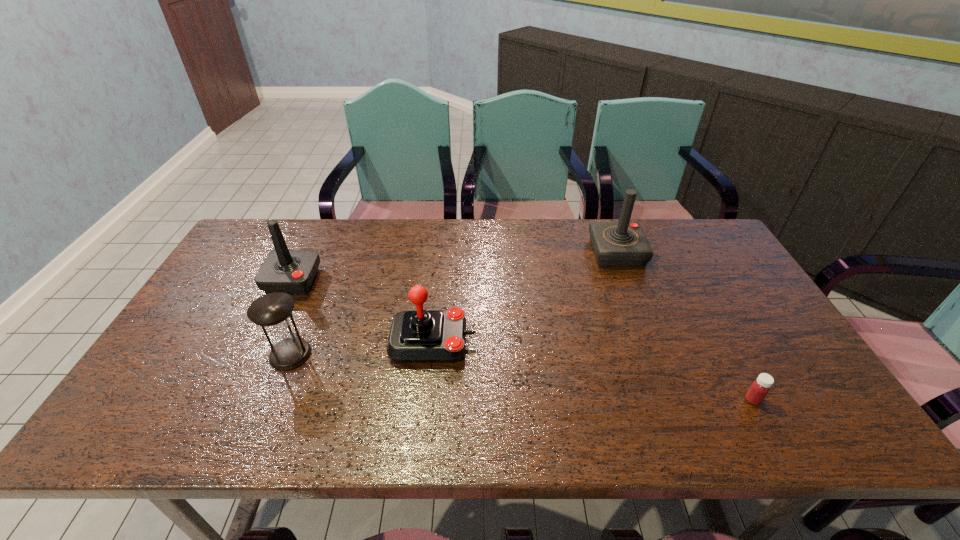
Find the location of `free point between the nearest joystick and the rightmost joystick`. free point between the nearest joystick and the rightmost joystick is located at coordinates (525, 296).

Find the location of `vacant space that's between the leftmost joystick and the nearest joystick`. vacant space that's between the leftmost joystick and the nearest joystick is located at coordinates (363, 311).

Where is `free spot between the hourglass and the second joystick from left to right`? free spot between the hourglass and the second joystick from left to right is located at coordinates (362, 348).

Where is `object that stands as the closest to the leftmost joystick`? object that stands as the closest to the leftmost joystick is located at coordinates (273, 311).

Where is `the closest object to the hourglass`? The width and height of the screenshot is (960, 540). the closest object to the hourglass is located at coordinates (x=292, y=271).

This screenshot has width=960, height=540. Identify the location of joystick that is the third closest to the medicine. (292, 271).

Identify which joystick is located as the nearest to the leftmost joystick. Please provide its 2D coordinates. Your answer should be formatted as a tuple, i.e. [(x, y)], where the tuple contains the x and y coordinates of a point satisfying the conditions above.

[(424, 336)]

You are a GUI agent. You are given a task and a screenshot of the screen. Output one action in this format:
    pyautogui.click(x=<x>, y=<y>)
    Task: Click on the vacant area in the image that satisfies the following two spatial constraints: 1. on the rectangular base of the rightmost object; 2. on the right side of the rightmost joystick
    This screenshot has width=960, height=540.
    Given the screenshot: What is the action you would take?
    pyautogui.click(x=673, y=400)

At what (x,y) coordinates should I click in order to perform the action: click on free point that satisfies the following two spatial constraints: 1. on the back side of the nearest object; 2. on the base of the second joystick from right to left. Please return your answer as a coordinate pair (x, y). This screenshot has width=960, height=540. Looking at the image, I should click on (721, 341).

The height and width of the screenshot is (540, 960). Identify the location of free region that satisfies the following two spatial constraints: 1. on the base of the third object from left to right; 2. on the back side of the nearest object. (427, 400).